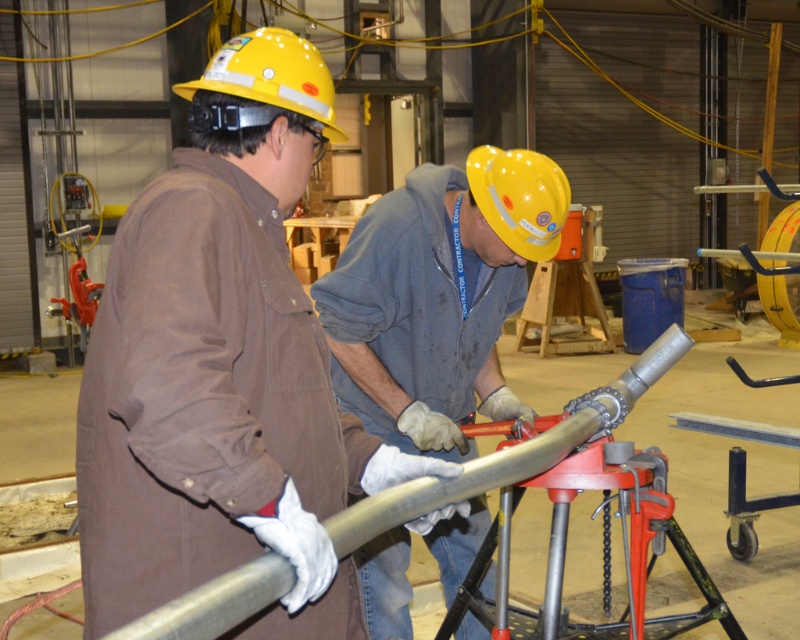
You are an inspector checking safety equipment in the workshop. You notice two yellow hard hats. The yellow hard hat at upper center and the yellow matte hard hat at center. Which one is closer to you?

The yellow hard hat at upper center is closer to you because it is in front of the yellow matte hard hat at center.

You are an inspector checking the workshop. You see the matte gray pipe at center and the yellow matte hard hat at center. Which object is taller?

The matte gray pipe at center is much taller than the yellow matte hard hat at center.